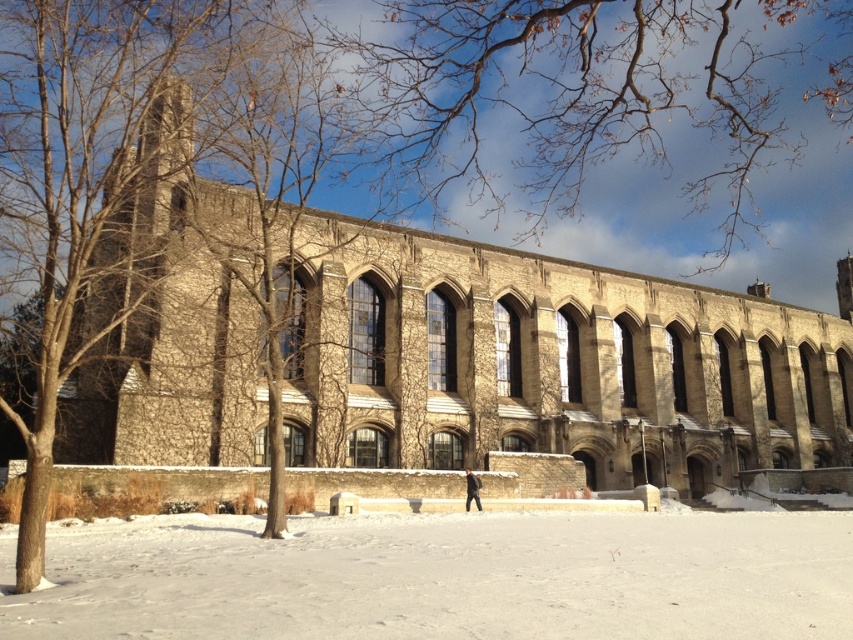
Question: Observing the image, what is the correct spatial positioning of brown stone church at center in reference to white powdery snow at lower center?

Choices:
 (A) right
 (B) left

Answer: (A)

Question: Which of the following is the closest to the observer?

Choices:
 (A) (228, 579)
 (B) (129, 394)

Answer: (A)

Question: From the image, what is the correct spatial relationship of brown stone church at center in relation to white powdery snow at lower center?

Choices:
 (A) above
 (B) below

Answer: (A)

Question: Is brown stone church at center behind white powdery snow at lower center?

Choices:
 (A) no
 (B) yes

Answer: (B)

Question: Which object appears closest to the camera in this image?

Choices:
 (A) brown stone church at center
 (B) white powdery snow at lower center

Answer: (B)